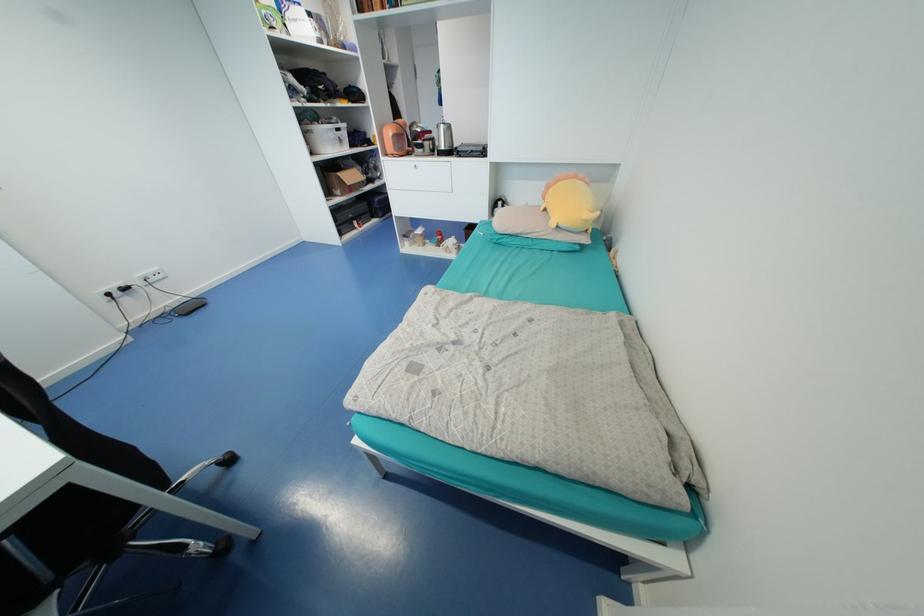
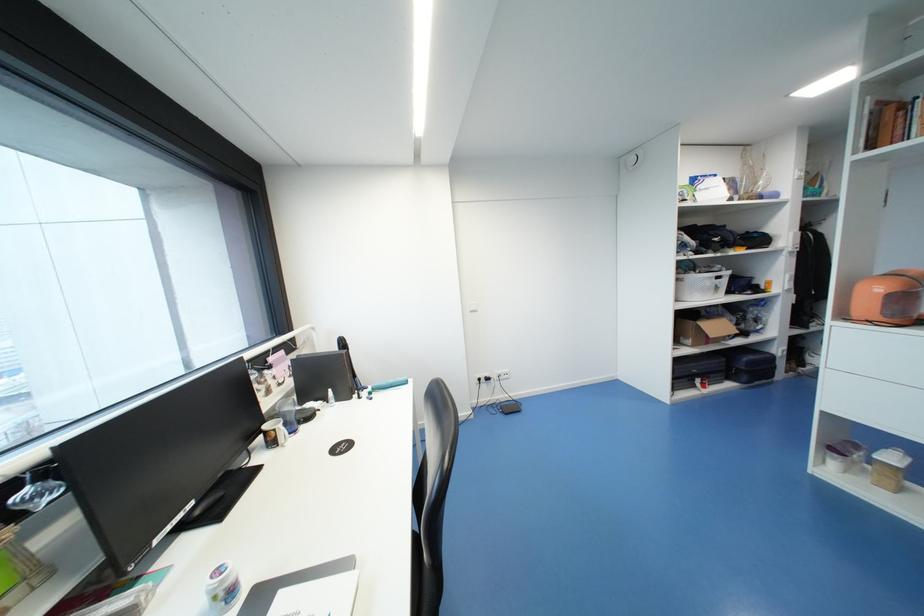
Question: How did the camera likely rotate?

Choices:
 (A) Left
 (B) Right
 (C) Up
 (D) Down

Answer: (A)